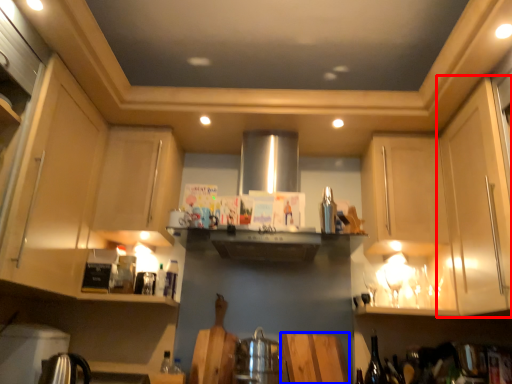
Question: Which point is closer to the camera, cabinetry (highlighted by a red box) or plywood (highlighted by a blue box)?

Choices:
 (A) cabinetry
 (B) plywood

Answer: (A)